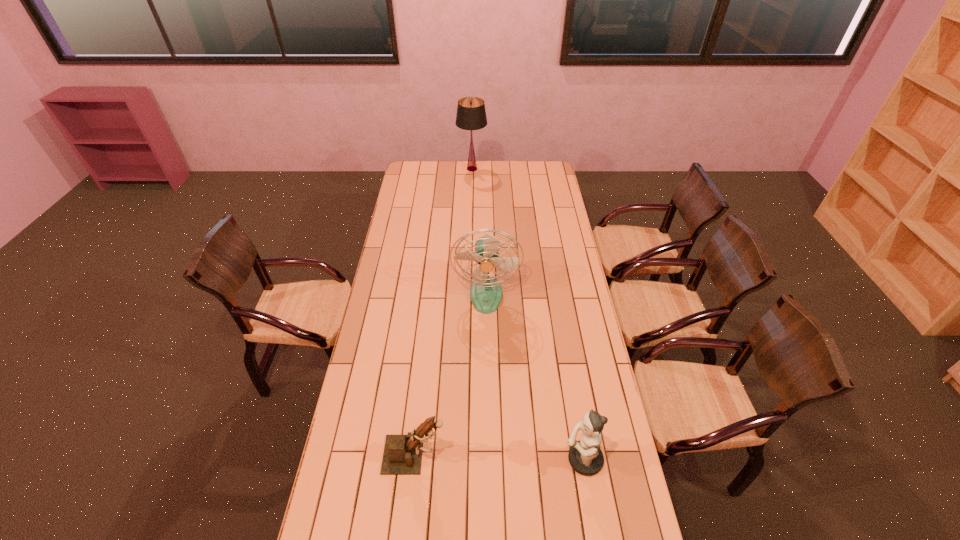
You are a GUI agent. You are given a task and a screenshot of the screen. Output one action in this format:
    pyautogui.click(x=<x>, y=<y>)
    Task: Click on the farthest object
    This screenshot has height=540, width=960.
    Given the screenshot: What is the action you would take?
    pyautogui.click(x=471, y=115)

Identify the location of fan. (486, 293).

Find the location of a particular element. the right figurine is located at coordinates (585, 456).

This screenshot has width=960, height=540. What are the coordinates of `the left figurine` in the screenshot? It's located at (402, 455).

Where is `vacant space located 0.290m on the front-facing side of the farthest object`? Image resolution: width=960 pixels, height=540 pixels. vacant space located 0.290m on the front-facing side of the farthest object is located at coordinates (534, 169).

You are a GUI agent. You are given a task and a screenshot of the screen. Output one action in this format:
    pyautogui.click(x=<x>, y=<y>)
    Task: Click on the free space located 0.330m in front of the fan, directing airflow
    
    Given the screenshot: What is the action you would take?
    (x=488, y=380)

This screenshot has height=540, width=960. I want to click on vacant space located on the front-facing side of the right figurine, so [x=541, y=460].

The image size is (960, 540). I want to click on vacant position located 0.340m on the front-facing side of the right figurine, so click(458, 460).

Identify the location of vacant space situated 0.050m on the front-facing side of the right figurine. The width and height of the screenshot is (960, 540). (547, 460).

Find the location of `vacant space located 0.080m on the front-facing side of the left figurine`. vacant space located 0.080m on the front-facing side of the left figurine is located at coordinates (471, 455).